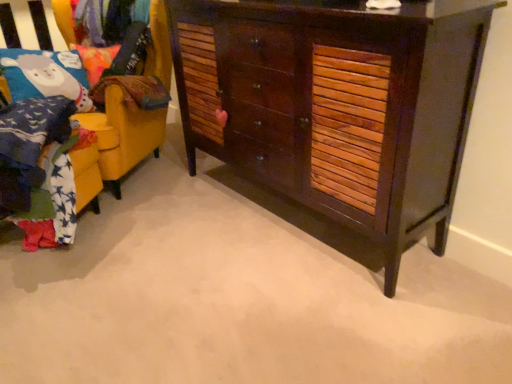
Question: From a real-world perspective, relative to velvet fabric pillow at upper left, is yellow fabric chair at left vertically above or below?

Choices:
 (A) below
 (B) above

Answer: (A)

Question: Would you say yellow fabric chair at left is to the left or to the right of velvet fabric pillow at upper left in the picture?

Choices:
 (A) right
 (B) left

Answer: (B)

Question: Based on their relative distances, which object is farther from the dark wood cabinet at center?

Choices:
 (A) velvet fabric pillow at upper left
 (B) yellow fabric chair at left

Answer: (A)

Question: Which is nearer to the yellow fabric chair at left?

Choices:
 (A) dark wood cabinet at center
 (B) velvet fabric pillow at upper left

Answer: (B)